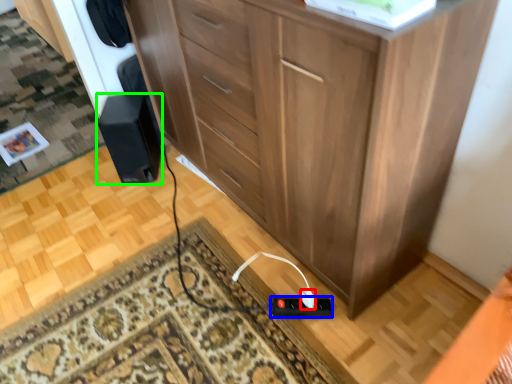
Question: Which is farther away from plug (highlighted by a red box)? plug (highlighted by a blue box) or speaker (highlighted by a green box)?

Choices:
 (A) plug
 (B) speaker

Answer: (B)